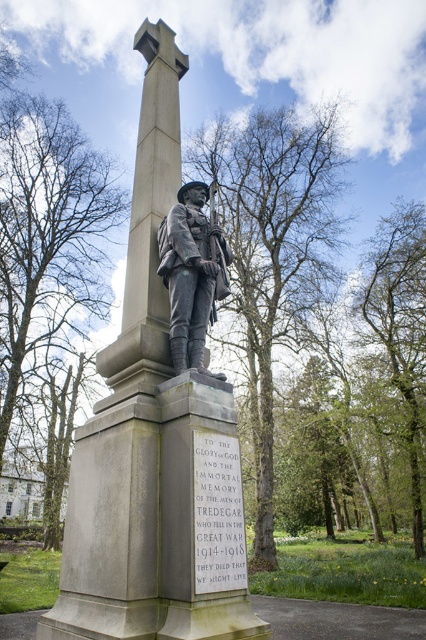
You are a park maintenance worker who needs to clean both the gray stone statue at center and the bronze statue at center. You have a 3.5 feet long extension pole. Can you reach both statues from your current position without moving closer? Explain your reasoning.

The distance between the gray stone statue at center and the bronze statue at center is 3.58 feet. Since the extension pole is 3.5 feet long, it is slightly shorter than the distance between them. Therefore, you cannot reach both statues without moving closer.

What is located at the coordinates point (144, 432)?

The gray stone statue at center is located at point (144, 432).